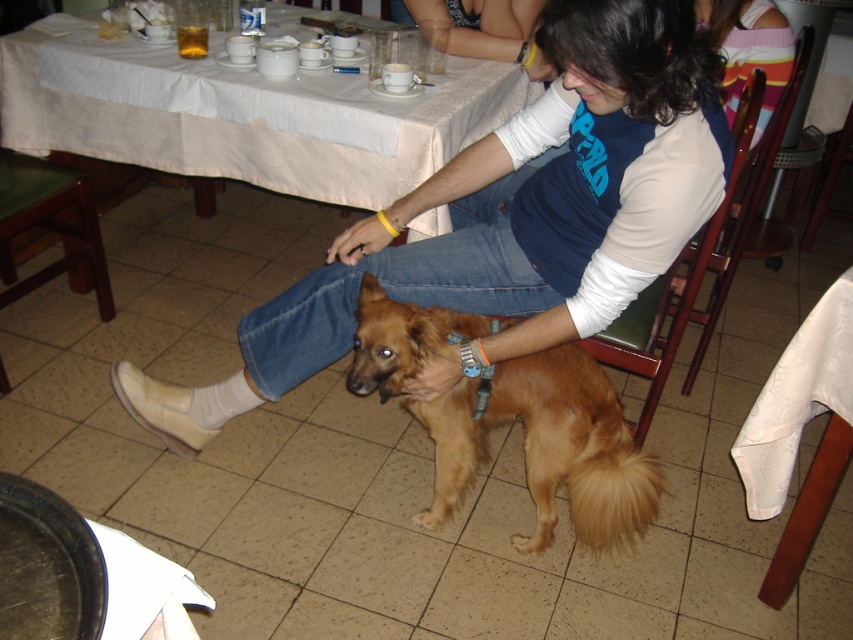
Who is higher up, brown denim jeans at center or white cloth-covered table at center?

Positioned higher is white cloth-covered table at center.

Is point (554, 260) in front of point (373, 163)?

Yes, it is.

The width and height of the screenshot is (853, 640). I want to click on brown denim jeans at center, so click(x=509, y=216).

Does white cloth-covered table at center have a larger size compared to golden fur dog at center?

Indeed, white cloth-covered table at center has a larger size compared to golden fur dog at center.

Does white cloth-covered table at center come in front of golden fur dog at center?

No.

Find the location of `white cloth-covered table at center`. white cloth-covered table at center is located at coordinates (247, 116).

Where is `white cloth-covered table at center`? The height and width of the screenshot is (640, 853). white cloth-covered table at center is located at coordinates (247, 116).

Does point (587, 502) lie behind point (809, 324)?

Yes, point (587, 502) is behind point (809, 324).

Can you confirm if golden fur dog at center is thinner than white fabric table at lower right?

Incorrect, golden fur dog at center's width is not less than white fabric table at lower right's.

Describe the element at coordinates (544, 445) in the screenshot. I see `golden fur dog at center` at that location.

Find the location of a particular element. The height and width of the screenshot is (640, 853). golden fur dog at center is located at coordinates (544, 445).